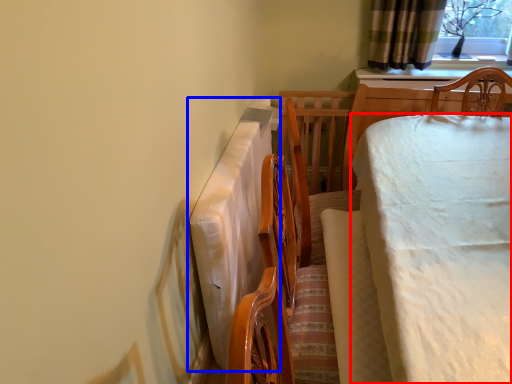
Question: Which point is closer to the camera, table (highlighted by a red box) or tablecloth (highlighted by a blue box)?

Choices:
 (A) table
 (B) tablecloth

Answer: (A)